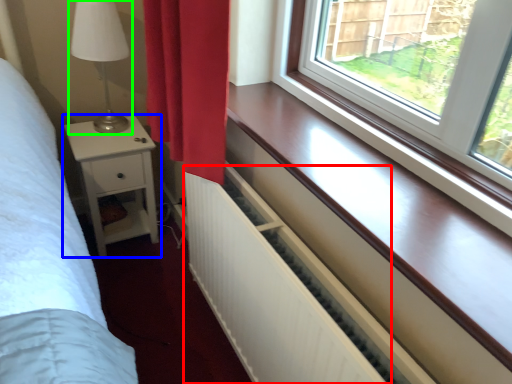
Question: Estimate the real-world distances between objects in this image. Which object is closer to radiator (highlighted by a red box), nightstand (highlighted by a blue box) or table lamp (highlighted by a green box)?

Choices:
 (A) nightstand
 (B) table lamp

Answer: (A)